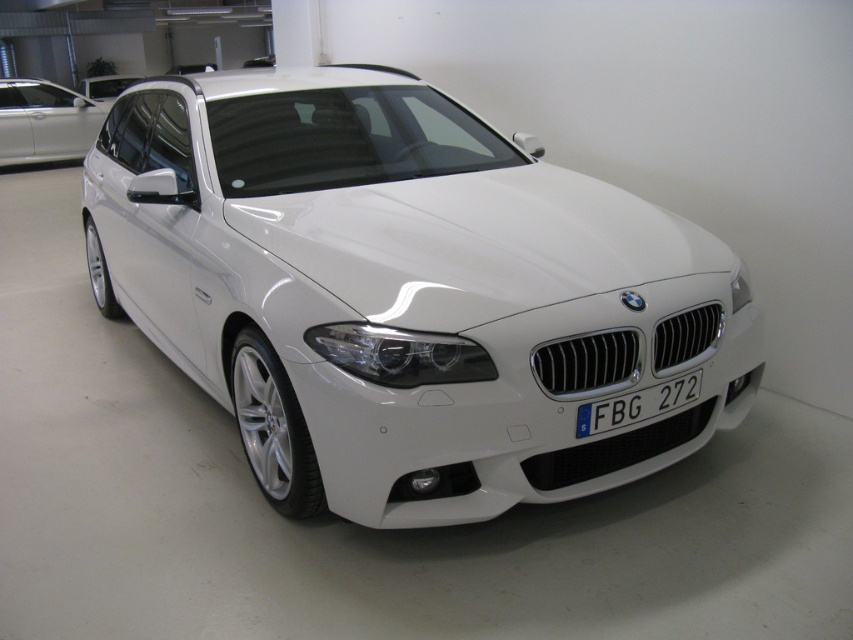
Question: Is white glossy car at center wider than blue metallic license plate at center?

Choices:
 (A) yes
 (B) no

Answer: (A)

Question: Estimate the real-world distances between objects in this image. Which object is farther from the satin silver car at upper left?

Choices:
 (A) white glossy car at upper center
 (B) white glossy car at center

Answer: (B)

Question: Can you confirm if white glossy car at center is positioned below blue metallic license plate at center?

Choices:
 (A) yes
 (B) no

Answer: (B)

Question: Which of the following is the farthest from the observer?

Choices:
 (A) (293, 182)
 (B) (30, 106)
 (C) (595, 403)
 (D) (125, 81)

Answer: (D)

Question: Is blue metallic license plate at center positioned in front of white glossy car at upper center?

Choices:
 (A) yes
 (B) no

Answer: (A)

Question: Which object is farther from the camera taking this photo?

Choices:
 (A) blue metallic license plate at center
 (B) white glossy car at upper center

Answer: (B)